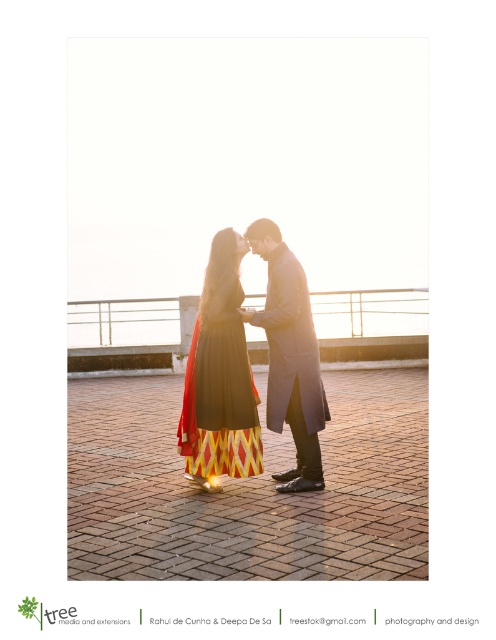
Is point (242, 461) positioned after point (229, 316)?

No, (242, 461) is in front of (229, 316).

Who is positioned more to the left, matte black dress at center or black matte dress at center?

Positioned to the left is matte black dress at center.

This screenshot has height=640, width=496. I want to click on matte black dress at center, so click(x=220, y=376).